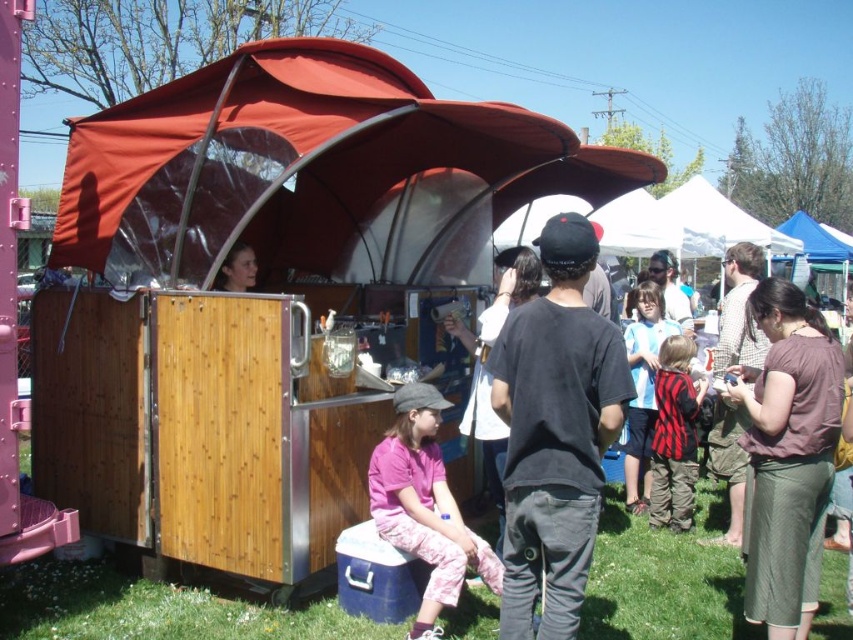
Consider the image. You are standing at the entrance of the fair and want to locate the food stall. Where is the red fabric canopy at center located in terms of coordinates?

The red fabric canopy at center is located at coordinates point [314,172].